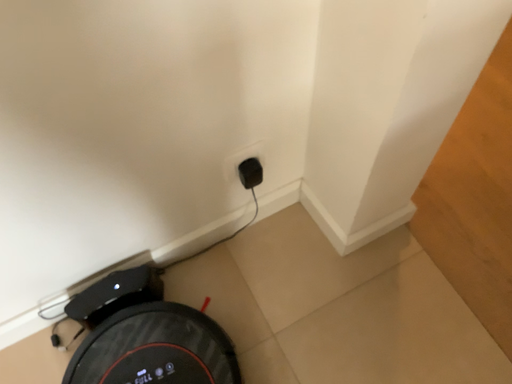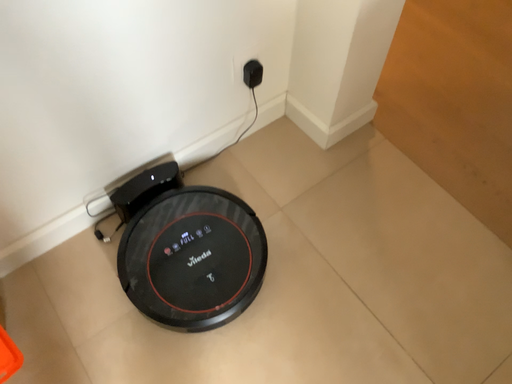
Question: Which way did the camera rotate in the video?

Choices:
 (A) rotated left
 (B) rotated right

Answer: (B)